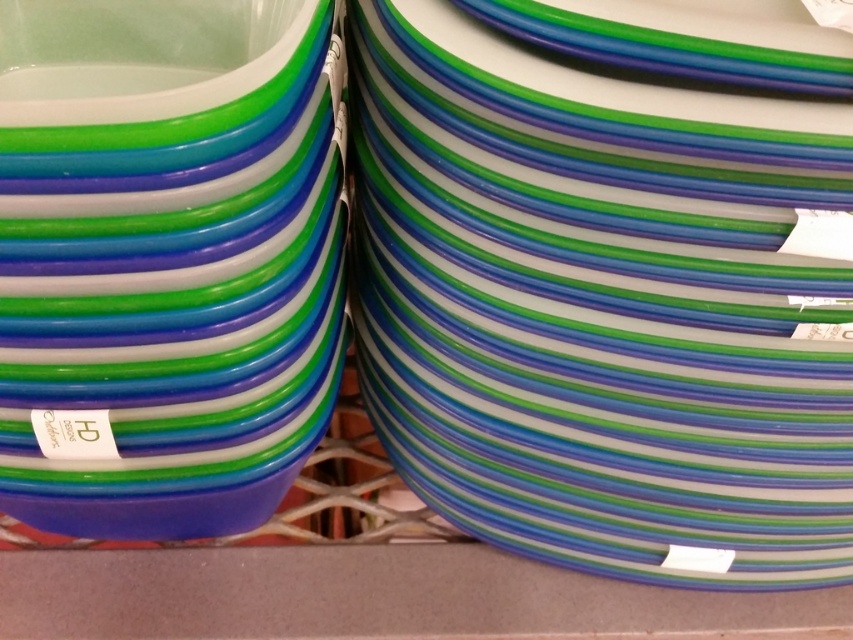
You are organizing a picnic and have two matte plastic plates in front of you. One is the matte plastic plate at center and the other is the matte plastic plate at left. Which plate is positioned to the right of the other?

The matte plastic plate at center is positioned to the right of the matte plastic plate at left.

You are organizing a picnic and need to choose between the matte plastic plate at center and the matte plastic plate at left. Which plate has a larger size?

The matte plastic plate at center is bigger than the matte plastic plate at left, so the matte plastic plate at center has a larger size.